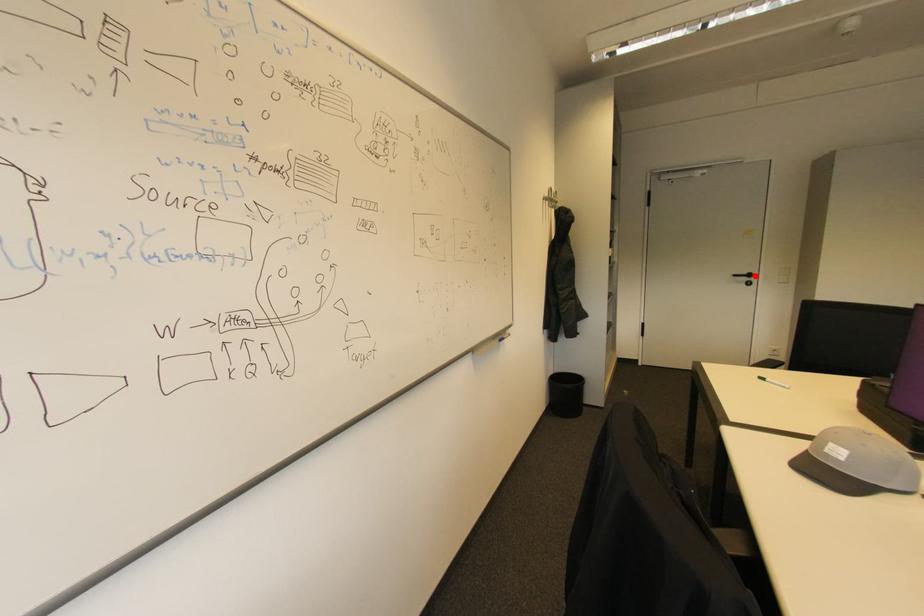
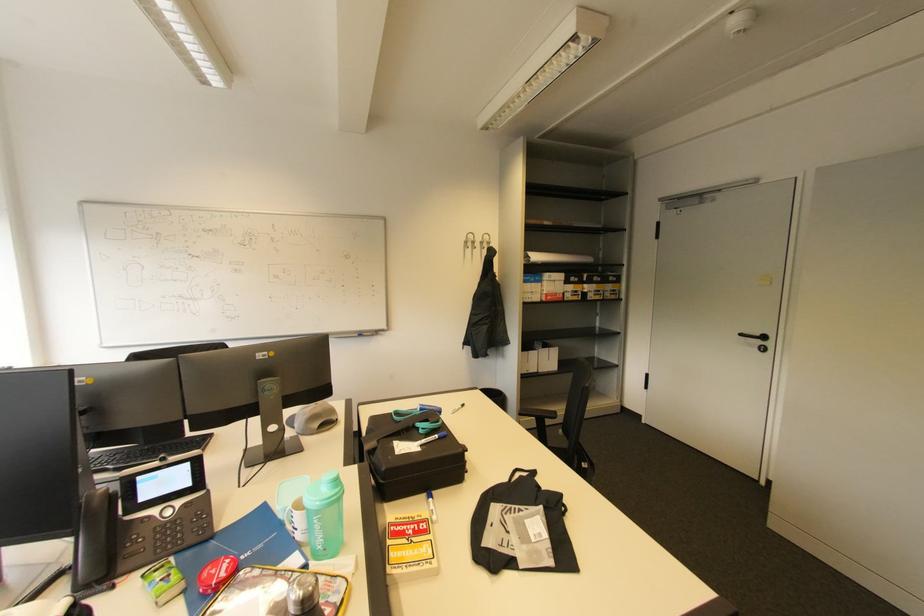
The point at the highlighted location is marked in the first image. Where is the corresponding point in the second image?

(769, 339)